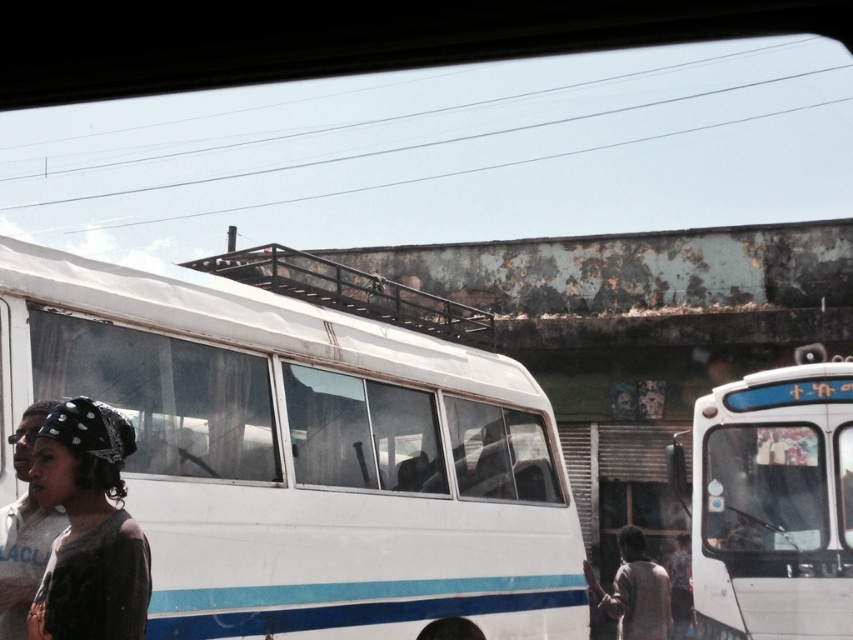
You are a photographer trying to capture the black textured headscarf at lower left in your shot. The camera you are using has a focal length of 50mm. If you want to include the entire white bus with a blue stripe in the background as well, should you increase or decrease the focal length?

To include the entire white bus with a blue stripe in the background while focusing on the black textured headscarf at lower left, you should decrease the focal length. A shorter focal length provides a wider field of view, allowing both the headscarf and the bus to fit within the frame.

You are standing at the bus station looking at the white bus with a blue stripe. There is a point marked at coordinates (88, 529). What object or feature does this point correspond to?

The point at coordinates (88, 529) corresponds to the black textured headscarf at lower left.

You are a photographer trying to capture a wide shot of the white matte bus at right and the black textured headscarf at lower left in the same frame. Given that your camera can only accommodate objects within a 3 meter width, will both fit comfortably in the frame?

The white matte bus at right is wider than the black textured headscarf at lower left. However, since the camera can accommodate up to 3 meters, and the bus is the wider object, as long as the bus itself is under 3 meters in width, both should fit. But without specific measurements, it depends on the bus size.